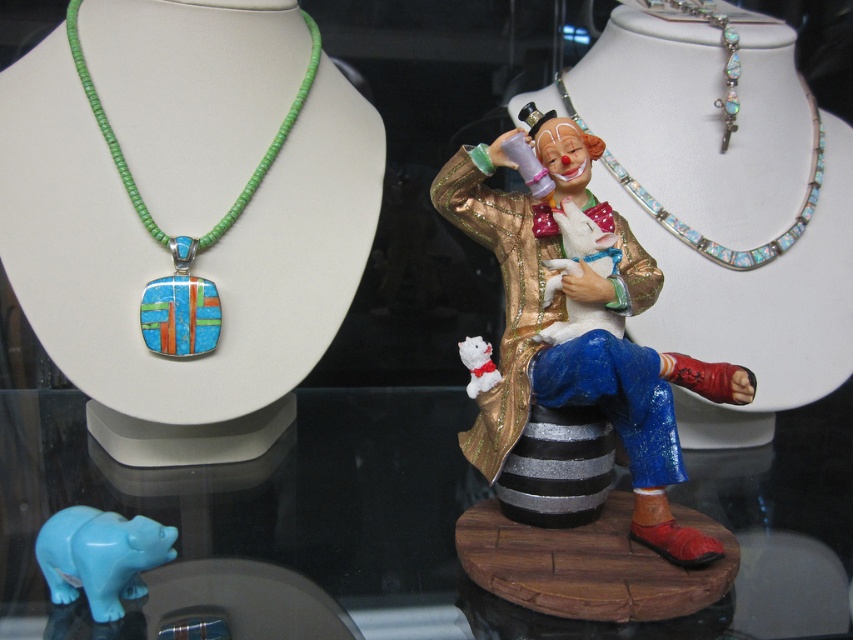
Question: Is shiny gold clown at center to the right of white plush toy at center from the viewer's perspective?

Choices:
 (A) yes
 (B) no

Answer: (A)

Question: Is turquoise glossy bear at lower left closer to the viewer compared to white plush toy at center?

Choices:
 (A) yes
 (B) no

Answer: (A)

Question: Is shiny gold clown at center to the right of opaline glass necklace at upper right from the viewer's perspective?

Choices:
 (A) yes
 (B) no

Answer: (B)

Question: Which object is the closest to the white plush toy at center?

Choices:
 (A) shiny gold clown at center
 (B) multicolored inlay pendant at left
 (C) opaline glass necklace at upper right
 (D) turquoise glossy bear at lower left

Answer: (A)

Question: Among these points, which one is farthest from the camera?

Choices:
 (A) (811, 173)
 (B) (148, 211)
 (C) (590, 145)

Answer: (A)

Question: Among these points, which one is nearest to the camera?

Choices:
 (A) (541, 349)
 (B) (39, 541)
 (C) (219, 221)
 (D) (495, 376)

Answer: (B)